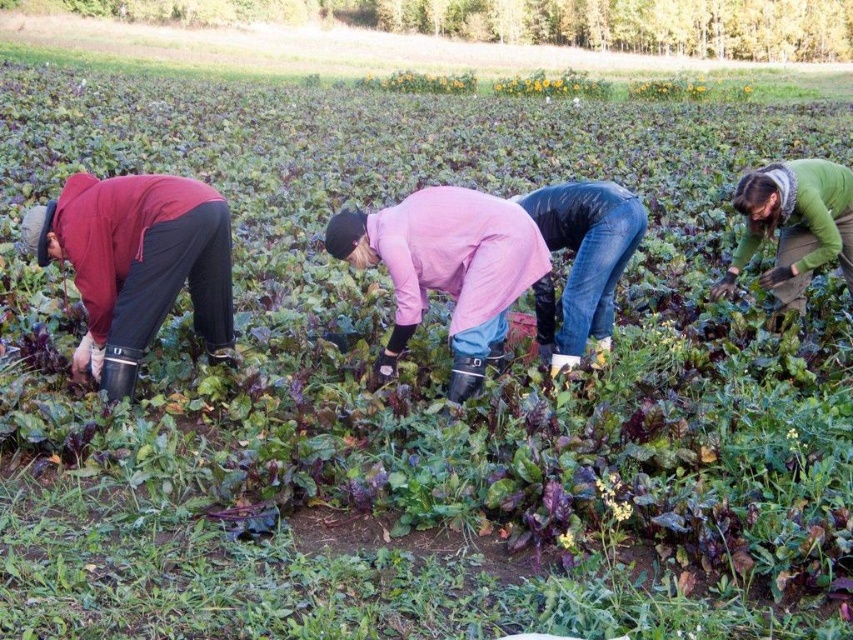
You are a drone operator flying above the agricultural field. You need to deliver a tool to the worker wearing the pink matte jacket at center and the worker wearing the green matte jacket at right. Which worker should you drop the tool closer to first based on their position?

The pink matte jacket at center is closer to the viewer than the green matte jacket at right, so you should drop the tool closer to the pink matte jacket at center first.

You are a farmer who wants to identify which worker is closer to the ground based on their jacket colors. Which worker wearing either the matte red jacket at left or the pink matte jacket at center is lower in height?

The matte red jacket at left is worn by a worker who is lower in height compared to the pink matte jacket at center, so the worker in the matte red jacket at left is closer to the ground.

You are a farmer planning to distribute tools to the workers in the field. The pink matte jacket at center and the green matte jacket at right are both working nearby. If you have a tool that requires more space to use, which worker should you give it to?

The pink matte jacket at center should be given the tool that requires more space because their width surpasses that of the green matte jacket at right, indicating they might have more room to maneuver.